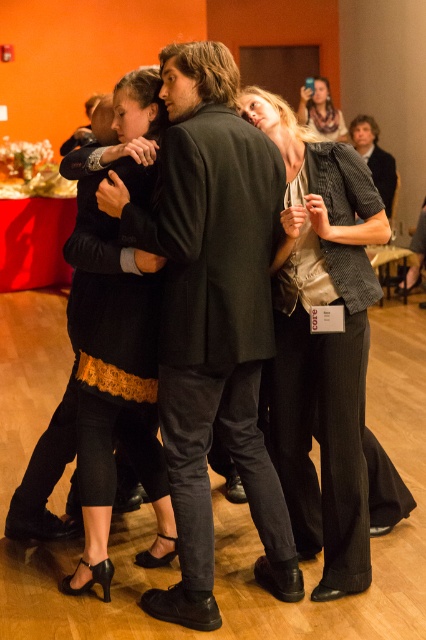
Does textured gray blazer at center appear on the left side of matte beige scarf at upper center?

Yes, textured gray blazer at center is to the left of matte beige scarf at upper center.

Is textured gray blazer at center shorter than matte beige scarf at upper center?

Incorrect, textured gray blazer at center's height does not fall short of matte beige scarf at upper center's.

You are a GUI agent. You are given a task and a screenshot of the screen. Output one action in this format:
    pyautogui.click(x=<x>, y=<y>)
    Task: Click on the textured gray blazer at center
    
    Given the screenshot: What is the action you would take?
    pyautogui.click(x=322, y=340)

I want to click on textured gray blazer at center, so click(x=322, y=340).

Does black matte suit at center appear on the right side of textured gray blazer at center?

In fact, black matte suit at center is to the left of textured gray blazer at center.

Looking at this image, who is more distant from viewer, (250, 429) or (334, 179)?

Point (250, 429)

Describe the element at coordinates (212, 317) in the screenshot. Image resolution: width=426 pixels, height=640 pixels. I see `black matte suit at center` at that location.

At what (x,y) coordinates should I click in order to perform the action: click on black matte suit at center. Please return your answer as a coordinate pair (x, y). This screenshot has width=426, height=640. Looking at the image, I should click on (212, 317).

Which of these two, black matte suit at center or matte beige scarf at upper center, stands shorter?

Standing shorter between the two is matte beige scarf at upper center.

Does black matte suit at center have a smaller size compared to matte beige scarf at upper center?

No.

I want to click on black matte suit at center, so (212, 317).

The image size is (426, 640). In order to click on black matte suit at center in this screenshot , I will do [x=212, y=317].